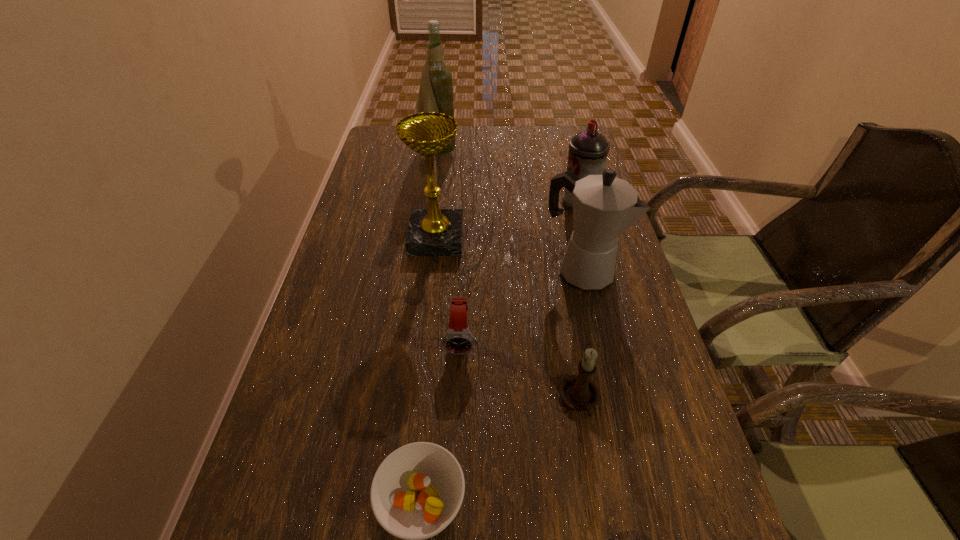
Identify the location of blank area located 0.050m on the front-facing side of the award. (482, 239).

What are the coordinates of `vacant area situated on the left of the coffeepot` in the screenshot? It's located at (436, 271).

The image size is (960, 540). Find the location of `vacant region located on the back of the second farthest object`. vacant region located on the back of the second farthest object is located at coordinates (560, 133).

Find the location of a particular element. vacant space situated on the side of the sixth farthest object with the handle is located at coordinates (598, 502).

The height and width of the screenshot is (540, 960). I want to click on vacant region located 0.180m on the face of the sixth tallest object, so click(x=458, y=450).

Find the location of a particular element. object present at the far edge is located at coordinates (436, 94).

This screenshot has height=540, width=960. What are the coordinates of `object present at the left edge` in the screenshot? It's located at (436, 94).

Locate an element on the screen. The width and height of the screenshot is (960, 540). coffeepot present at the right edge is located at coordinates (604, 207).

The height and width of the screenshot is (540, 960). Identify the location of aerosol can present at the right edge. (588, 150).

In order to click on candle holder at the right edge in this screenshot , I will do `click(578, 392)`.